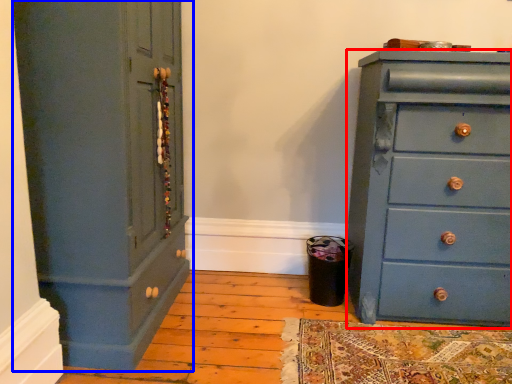
Question: Which of the following is the closest to the observer, chest of drawers (highlighted by a red box) or cupboard (highlighted by a blue box)?

Choices:
 (A) chest of drawers
 (B) cupboard

Answer: (B)